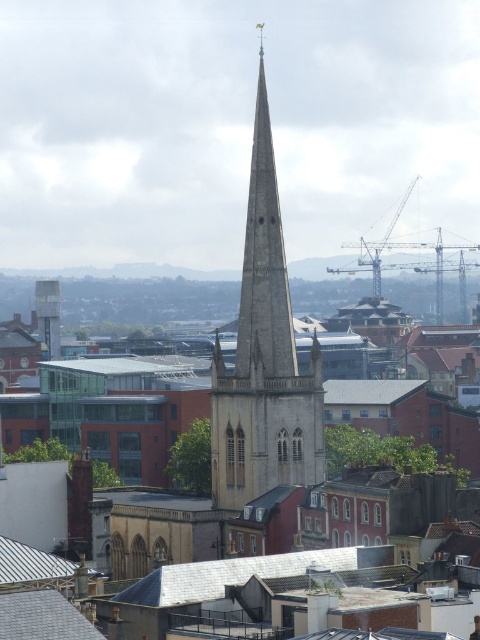
Question: Which object is positioned closest to the metallic gray tower at center?

Choices:
 (A) gray slate roof at lower left
 (B) smooth stone spire at center

Answer: (B)

Question: Which is nearer to the smooth stone spire at center?

Choices:
 (A) gray slate roof at lower left
 (B) metallic gray tower at center
 (C) gray slate roof at center

Answer: (C)

Question: Among these objects, which one is farthest from the camera?

Choices:
 (A) metallic gray tower at center
 (B) smooth stone spire at center
 (C) gray slate roof at lower left

Answer: (A)

Question: Is the position of gray slate roof at lower left less distant than that of metallic gray tower at center?

Choices:
 (A) yes
 (B) no

Answer: (A)

Question: Is smooth stone spire at center bigger than gray slate roof at center?

Choices:
 (A) no
 (B) yes

Answer: (B)

Question: Is smooth stone spire at center above gray slate roof at lower left?

Choices:
 (A) yes
 (B) no

Answer: (A)